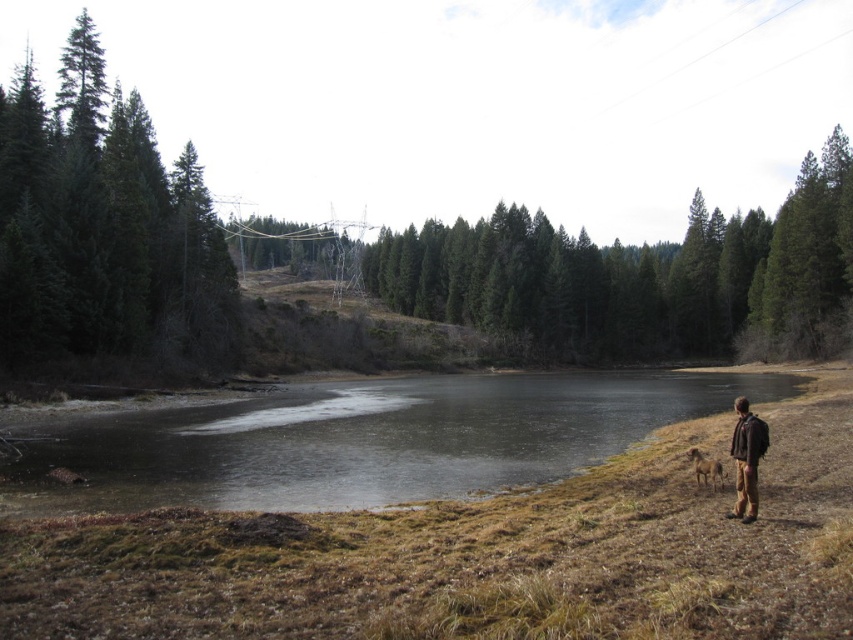
Question: Does frozen ice at lower center have a greater width compared to green matte tree at upper left?

Choices:
 (A) yes
 (B) no

Answer: (B)

Question: Does green matte tree at upper left appear under brown leather jacket at lower right?

Choices:
 (A) no
 (B) yes

Answer: (A)

Question: Among these points, which one is nearest to the camera?

Choices:
 (A) (740, 422)
 (B) (61, 157)

Answer: (A)

Question: Which point is closer to the camera?

Choices:
 (A) brown leather jacket at lower right
 (B) green matte tree at upper left
 (C) frozen ice at lower center

Answer: (A)

Question: Which is farther from the frozen ice at lower center?

Choices:
 (A) green matte tree at upper left
 (B) brown leather jacket at lower right

Answer: (A)

Question: Does frozen ice at lower center have a larger size compared to green matte tree at upper left?

Choices:
 (A) yes
 (B) no

Answer: (B)